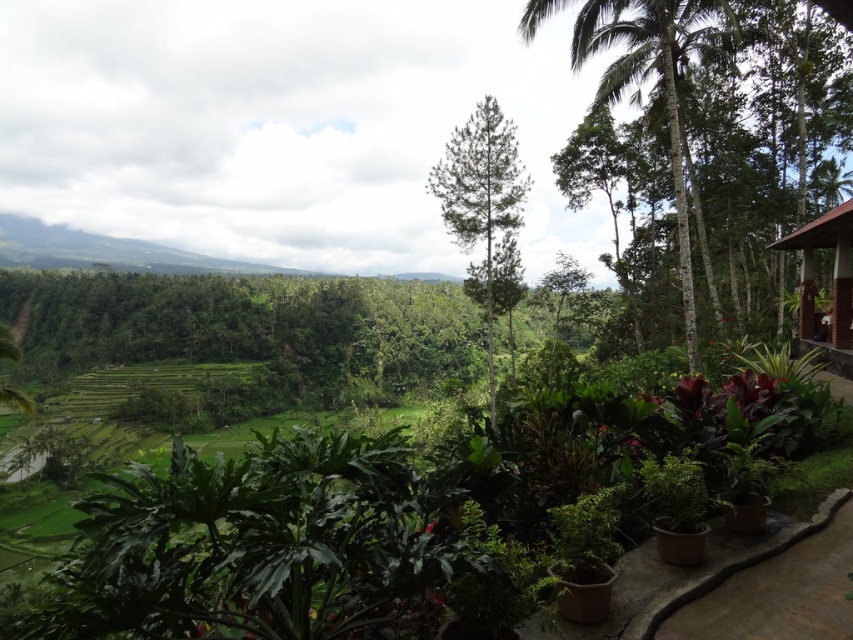
You are a gardener who needs to place a new bench that is 2 meters long. You see the brown concrete path at lower right and the brown wooden hut at right. Which location can accommodate the bench without exceeding its length?

The brown wooden hut at right has a larger size than the brown concrete path at lower right, so the bench can be placed at the brown wooden hut at right since it can accommodate the 2 meters length.